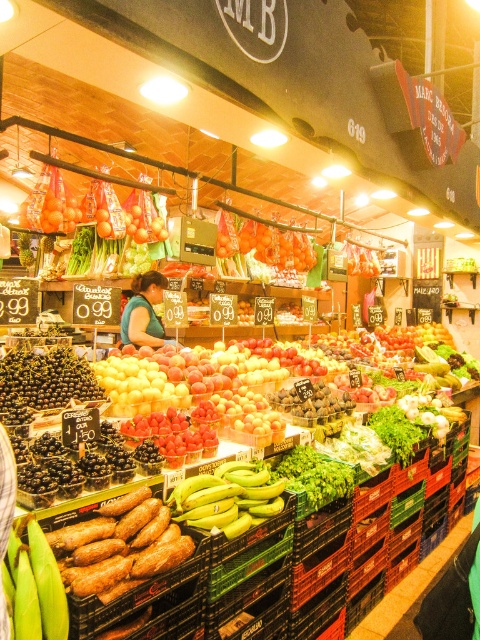
You are a customer at the fruit market and want to buy the larger of the two green items. Which one should you choose between the green matte bananas at center and the green matte corn at lower left?

The green matte bananas at center is bigger than the green matte corn at lower left, so you should choose the green matte bananas at center.

You are a customer at the fruit market and want to pick up both the green matte bananas at center and the green matte corn at lower left. Which one is located to the left of the other?

The green matte corn at lower left is located to the left of the green matte bananas at center.

You are a customer at the fruit and vegetable market stall and want to find the shiny red tomato at upper left. Based on the coordinates provided, can you determine its position relative to the center of the stall?

The shiny red tomato at upper left is located at point coordinates of 0.336 on the x axis and 0.252 on the y axis. Since the center of the stall would be at coordinates 0.5 on both axes, the tomato is positioned to the left and above the center of the stall.